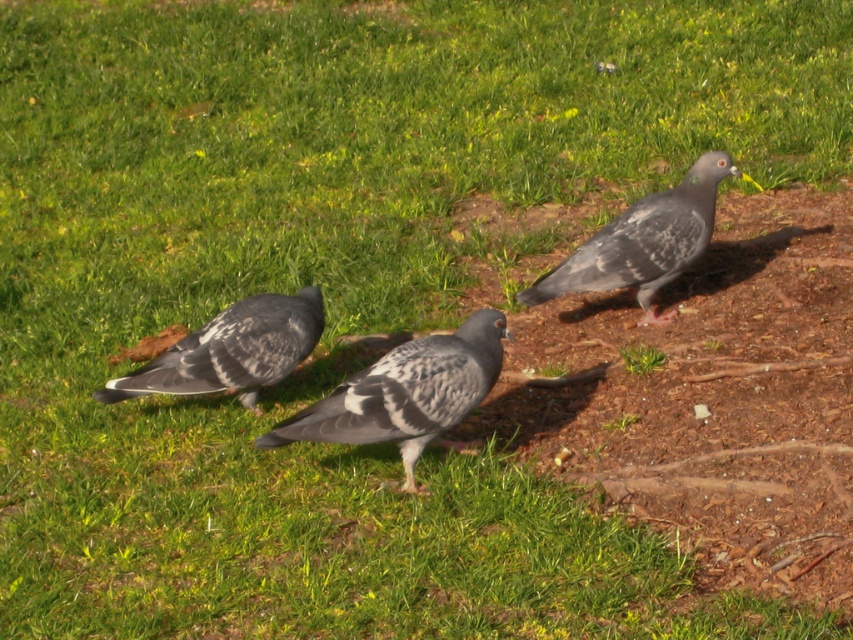
Question: Does speckled gray pigeon at center lie in front of gray speckled pigeon at lower left?

Choices:
 (A) no
 (B) yes

Answer: (A)

Question: Estimate the real-world distances between objects in this image. Which object is farther from the speckled feather pigeon at center?

Choices:
 (A) speckled gray pigeon at center
 (B) gray speckled pigeon at lower left

Answer: (A)

Question: Among these points, which one is farthest from the camera?

Choices:
 (A) (258, 360)
 (B) (422, 448)
 (C) (519, 292)

Answer: (C)

Question: Is speckled gray pigeon at center smaller than gray speckled pigeon at lower left?

Choices:
 (A) yes
 (B) no

Answer: (B)

Question: Is speckled feather pigeon at center to the left of gray speckled pigeon at lower left from the viewer's perspective?

Choices:
 (A) no
 (B) yes

Answer: (A)

Question: Which point appears farthest from the camera in this image?

Choices:
 (A) (289, 308)
 (B) (416, 406)
 (C) (639, 289)

Answer: (C)